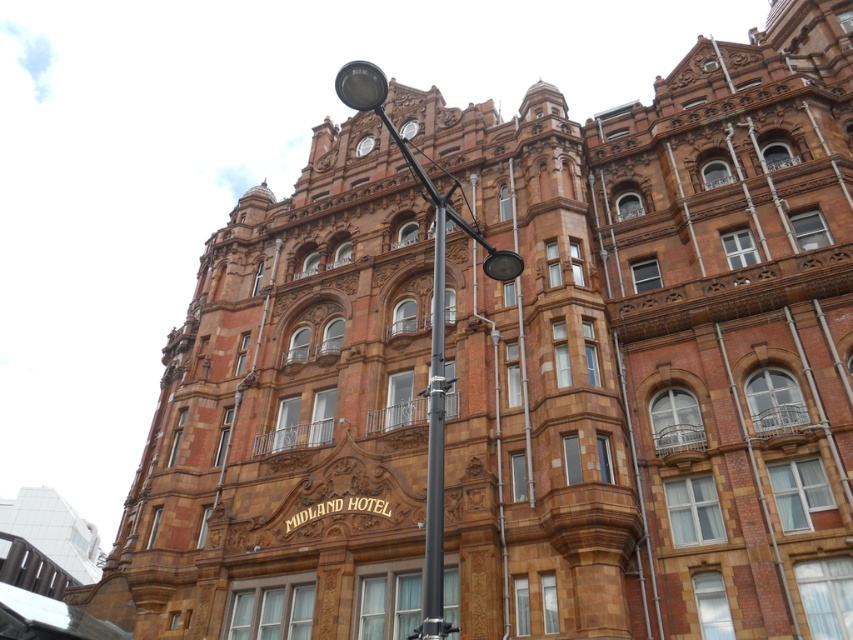
Is black metal lamp post at center above metallic gray pole at center?

Indeed, black metal lamp post at center is positioned over metallic gray pole at center.

Does black metal lamp post at center have a greater height compared to metallic gray pole at center?

Yes, black metal lamp post at center is taller than metallic gray pole at center.

Based on the photo, who is more forward, (421, 177) or (419, 394)?

Point (421, 177) is more forward.

The height and width of the screenshot is (640, 853). What are the coordinates of `black metal lamp post at center` in the screenshot? It's located at (431, 326).